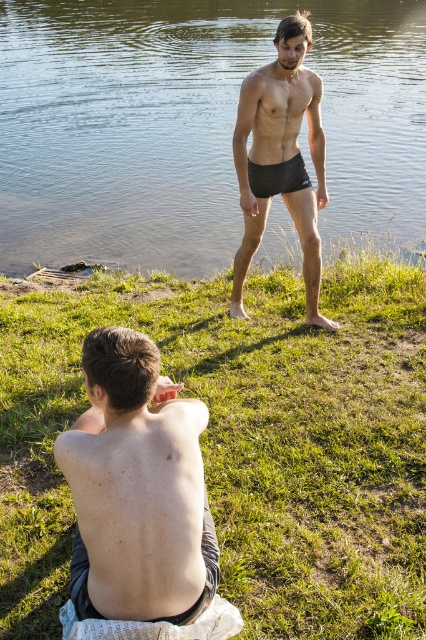
Question: Is green grass at center bigger than black matte shorts at center?

Choices:
 (A) no
 (B) yes

Answer: (B)

Question: Is clear water at center bigger than black matte shorts at center?

Choices:
 (A) no
 (B) yes

Answer: (B)

Question: Which object is the closest to the smooth skin back at center?

Choices:
 (A) black matte shorts at center
 (B) green grass at center

Answer: (B)

Question: Among these points, which one is farthest from the camera?

Choices:
 (A) (417, 230)
 (B) (157, 422)
 (C) (291, 164)
 (D) (302, 516)

Answer: (A)

Question: Estimate the real-world distances between objects in this image. Which object is farther from the green grass at center?

Choices:
 (A) clear water at center
 (B) smooth skin back at center

Answer: (A)

Question: Observing the image, what is the correct spatial positioning of clear water at center in reference to smooth skin back at center?

Choices:
 (A) right
 (B) left

Answer: (A)